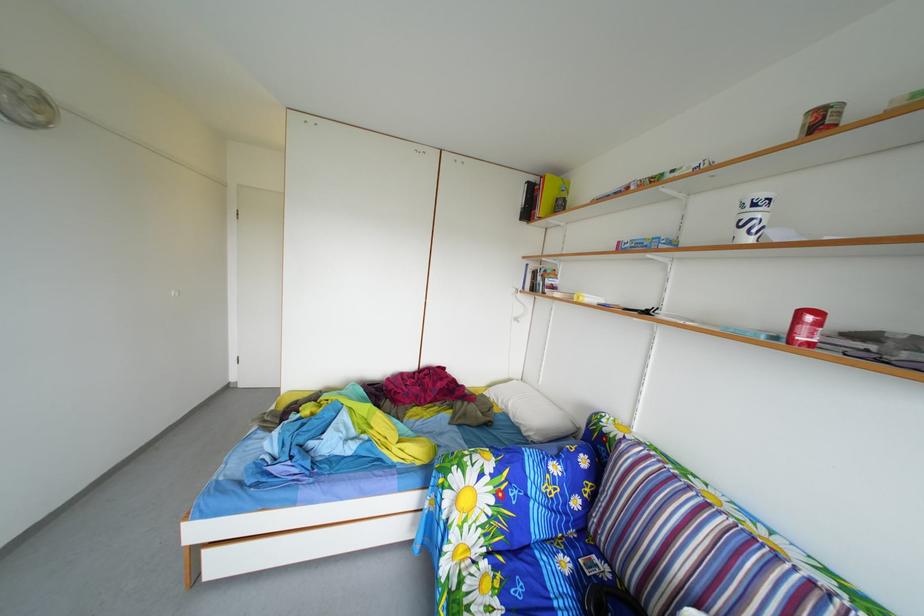
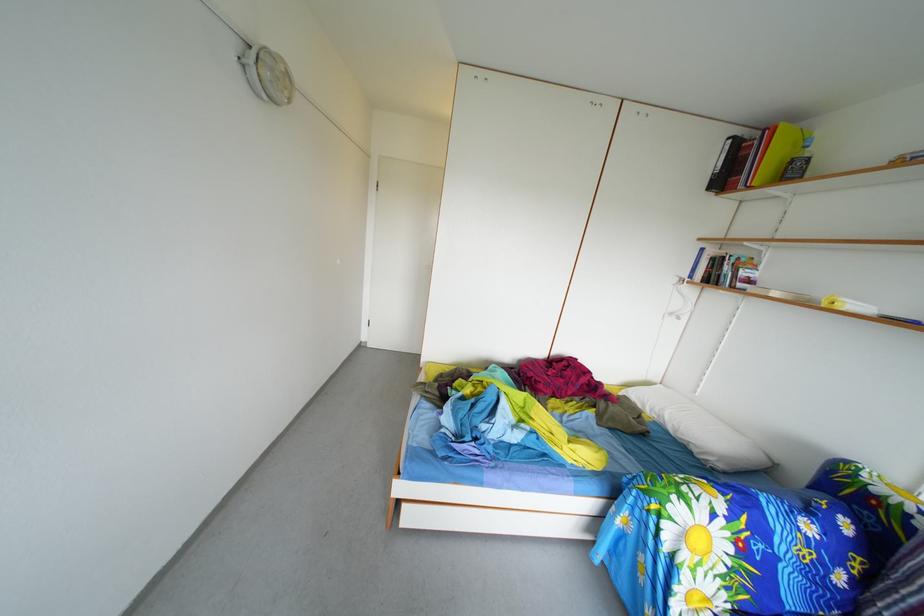
Question: Based on the continuous images, in which direction is the camera rotating? Reply with the corresponding letter.

Choices:
 (A) Left
 (B) Right
 (C) Up
 (D) Down

Answer: (A)